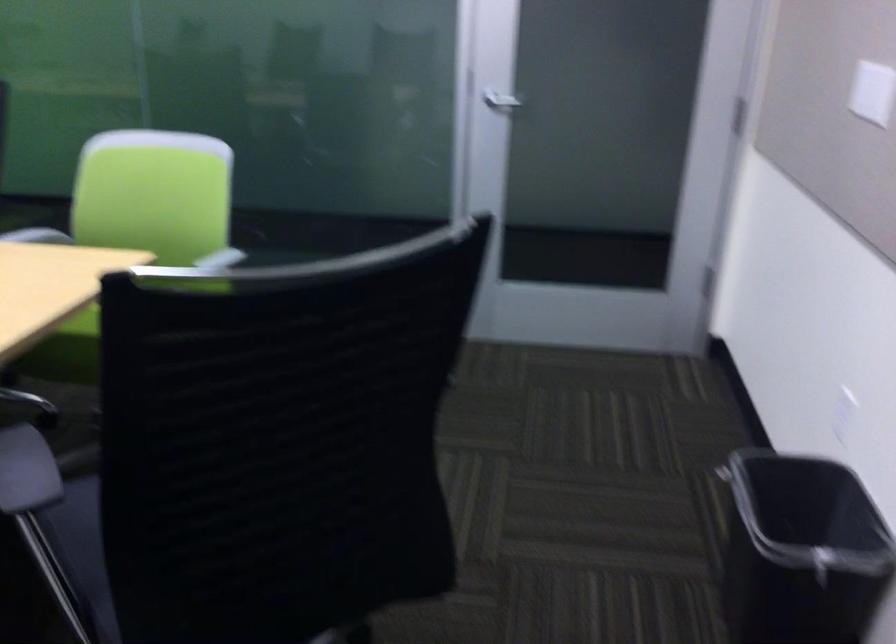
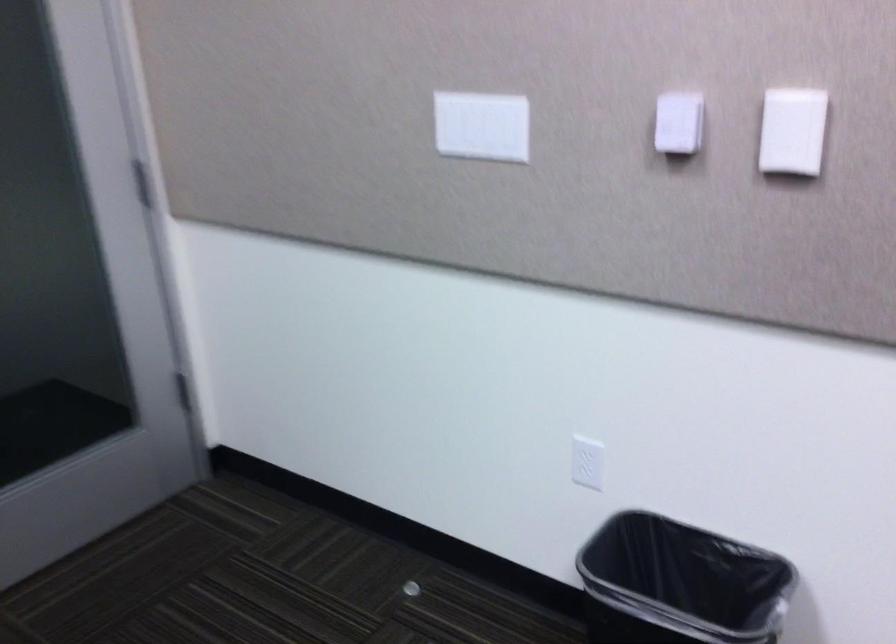
Where in the second image is the point corresponding to [718,476] from the first image?

(410, 589)